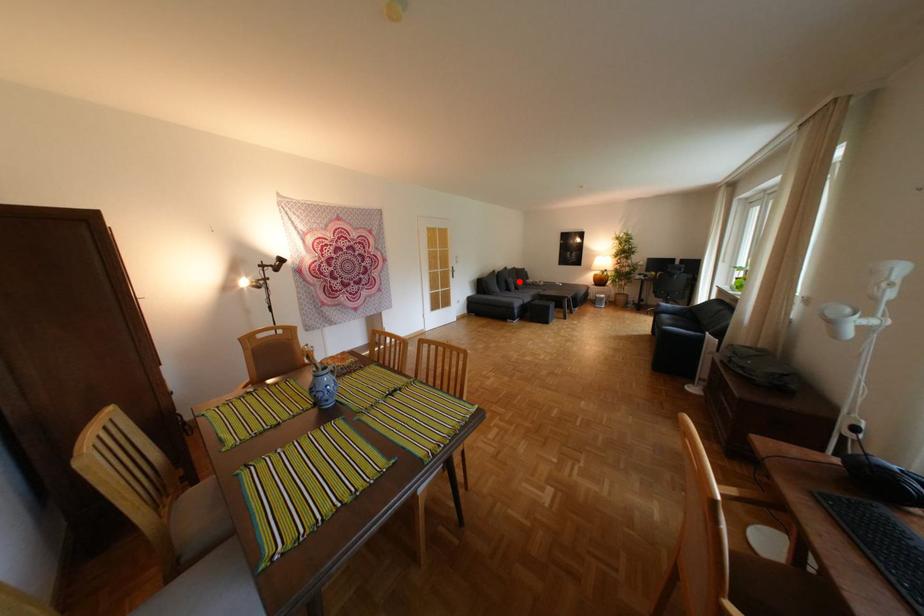
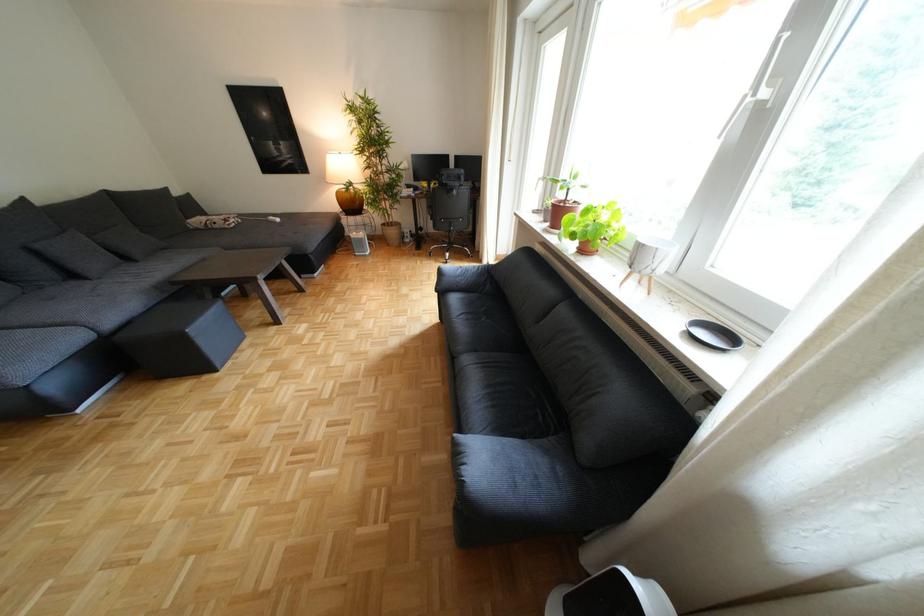
Question: A red point is marked in image1. In image2, is the corresponding 3D point closer to the camera or farther? Reply with the corresponding letter.

Choices:
 (A) The corresponding 3D point is closer.
 (B) The corresponding 3D point is farther.

Answer: (B)